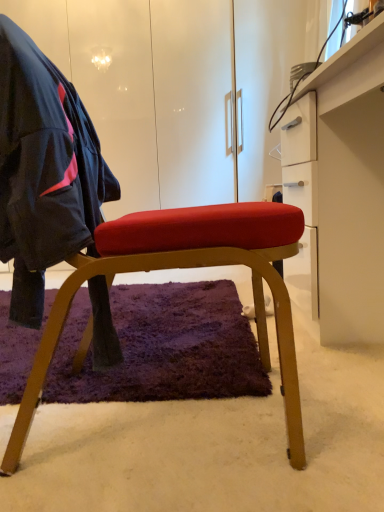
Question: Would you say matte black jacket at left contains white glossy desk at right?

Choices:
 (A) no
 (B) yes

Answer: (A)

Question: Is matte black jacket at left not close to white glossy desk at right?

Choices:
 (A) yes
 (B) no

Answer: (B)

Question: From a real-world perspective, is matte black jacket at left under white glossy desk at right?

Choices:
 (A) yes
 (B) no

Answer: (B)

Question: Does matte black jacket at left have a lesser width compared to white glossy desk at right?

Choices:
 (A) yes
 (B) no

Answer: (A)

Question: Can you confirm if matte black jacket at left is shorter than white glossy desk at right?

Choices:
 (A) yes
 (B) no

Answer: (A)

Question: Does matte black jacket at left have a larger size compared to white glossy desk at right?

Choices:
 (A) no
 (B) yes

Answer: (A)

Question: Does white glossy desk at right have a larger size compared to matte black jacket at left?

Choices:
 (A) yes
 (B) no

Answer: (A)

Question: Can you confirm if white glossy desk at right is taller than matte black jacket at left?

Choices:
 (A) yes
 (B) no

Answer: (A)

Question: From the image's perspective, is white glossy desk at right located above matte black jacket at left?

Choices:
 (A) no
 (B) yes

Answer: (B)

Question: Could you tell me if white glossy desk at right is facing matte black jacket at left?

Choices:
 (A) yes
 (B) no

Answer: (A)

Question: Considering the relative positions of white glossy desk at right and matte black jacket at left in the image provided, is white glossy desk at right to the right of matte black jacket at left from the viewer's perspective?

Choices:
 (A) yes
 (B) no

Answer: (A)

Question: From a real-world perspective, is white glossy desk at right on matte black jacket at left?

Choices:
 (A) no
 (B) yes

Answer: (A)

Question: Is matte wood chair at center far away from matte black jacket at left?

Choices:
 (A) no
 (B) yes

Answer: (A)